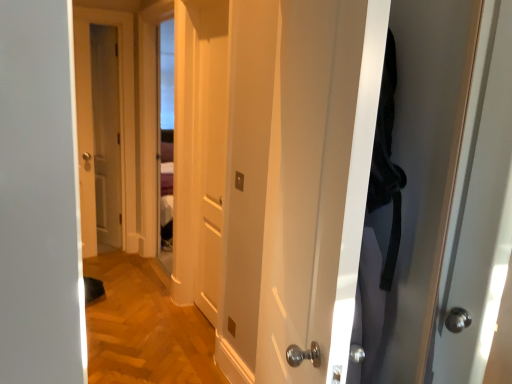
Question: In which direction should I rotate to look at white glossy door at center, which is counted as the third door, starting from the back?

Choices:
 (A) left
 (B) right

Answer: (B)

Question: From the image's perspective, would you say white glossy door at center, which is counted as the third door, starting from the back, is positioned over matte wooden door at left, the third door in the front-to-back sequence?

Choices:
 (A) no
 (B) yes

Answer: (A)

Question: Does white glossy door at center, the first door when ordered from front to back, have a greater height compared to matte wooden door at left, the third door in the front-to-back sequence?

Choices:
 (A) yes
 (B) no

Answer: (B)

Question: Does white glossy door at center, which is counted as the third door, starting from the back, have a lesser width compared to matte wooden door at left, marked as the 3th door in a right-to-left arrangement?

Choices:
 (A) yes
 (B) no

Answer: (B)

Question: From the image's perspective, is white glossy door at center, the first door when ordered from front to back, beneath matte wooden door at left, marked as the 3th door in a right-to-left arrangement?

Choices:
 (A) no
 (B) yes

Answer: (B)

Question: Are white glossy door at center, which is the 1th door in right-to-left order, and matte wooden door at left, which is the 1th door in left-to-right order, far apart?

Choices:
 (A) no
 (B) yes

Answer: (B)

Question: Does white glossy door at center, positioned as the 3th door in left-to-right order, lie behind matte wooden door at left, which is the 1th door in left-to-right order?

Choices:
 (A) yes
 (B) no

Answer: (B)

Question: From the image's perspective, does matte wooden door at left, the first door positioned from the back, appear lower than white matte door at center, placed as the 2th door when sorted from back to front?

Choices:
 (A) no
 (B) yes

Answer: (A)

Question: Considering the relative sizes of matte wooden door at left, which is the 1th door in left-to-right order, and white matte door at center, acting as the second door starting from the right, in the image provided, is matte wooden door at left, which is the 1th door in left-to-right order, wider than white matte door at center, acting as the second door starting from the right,?

Choices:
 (A) no
 (B) yes

Answer: (B)

Question: From a real-world perspective, is matte wooden door at left, the third door in the front-to-back sequence, on white matte door at center, acting as the second door starting from the right?

Choices:
 (A) no
 (B) yes

Answer: (B)

Question: Is matte wooden door at left, which is the 1th door in left-to-right order, oriented towards white matte door at center, acting as the second door starting from the right?

Choices:
 (A) no
 (B) yes

Answer: (A)

Question: Is white matte door at center, placed as the 2th door when sorted from back to front, a part of matte wooden door at left, the third door in the front-to-back sequence?

Choices:
 (A) yes
 (B) no

Answer: (B)

Question: Does matte wooden door at left, marked as the 3th door in a right-to-left arrangement, lie in front of white matte door at center, placed as the 2th door when sorted from back to front?

Choices:
 (A) yes
 (B) no

Answer: (B)

Question: From a real-world perspective, is white glossy door at center, the first door when ordered from front to back, beneath white matte door at center, the second door in the front-to-back sequence?

Choices:
 (A) yes
 (B) no

Answer: (B)